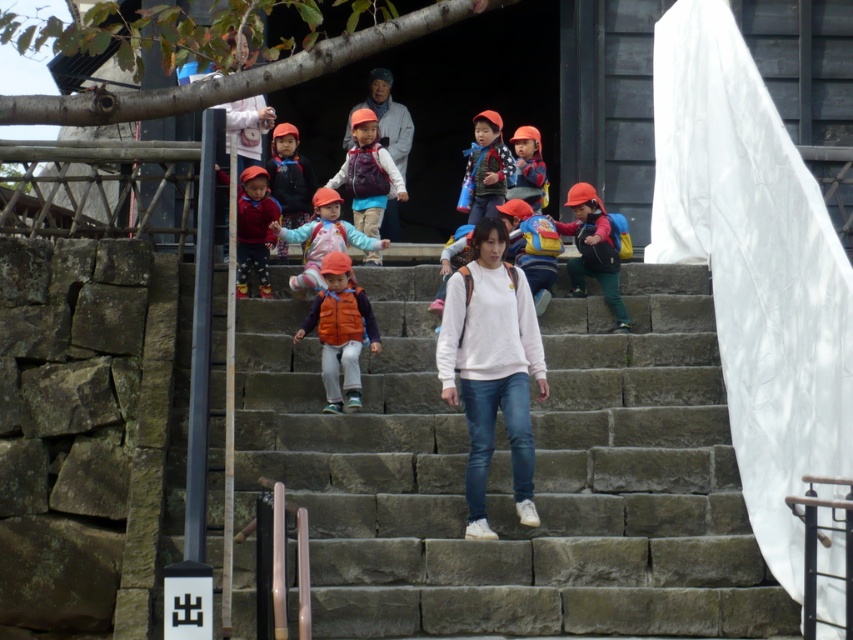
Between matte purple backpack at center and checkered fabric shirt at center, which one is positioned higher?

checkered fabric shirt at center

Can you confirm if matte purple backpack at center is positioned below checkered fabric shirt at center?

Indeed, matte purple backpack at center is positioned under checkered fabric shirt at center.

Which is behind, point (358, 148) or point (471, 202)?

Positioned behind is point (471, 202).

Locate an element on the screen. matte purple backpack at center is located at coordinates (368, 173).

Does point (519, 433) lie in front of point (390, 184)?

Yes, point (519, 433) is closer to viewer.

Is white matte sweatshirt at center shorter than matte purple backpack at center?

Yes, white matte sweatshirt at center is shorter than matte purple backpack at center.

Where is `white matte sweatshirt at center`? Image resolution: width=853 pixels, height=640 pixels. white matte sweatshirt at center is located at coordinates (491, 369).

Which is in front, point (465, 308) or point (303, 180)?

Point (465, 308)

Is white matte sweatshirt at center to the right of matte black jacket at center from the viewer's perspective?

Correct, you'll find white matte sweatshirt at center to the right of matte black jacket at center.

Between point (517, 374) and point (306, 186), which one is positioned behind?

Positioned behind is point (306, 186).

Find the location of `white matte sweatshirt at center`. white matte sweatshirt at center is located at coordinates (491, 369).